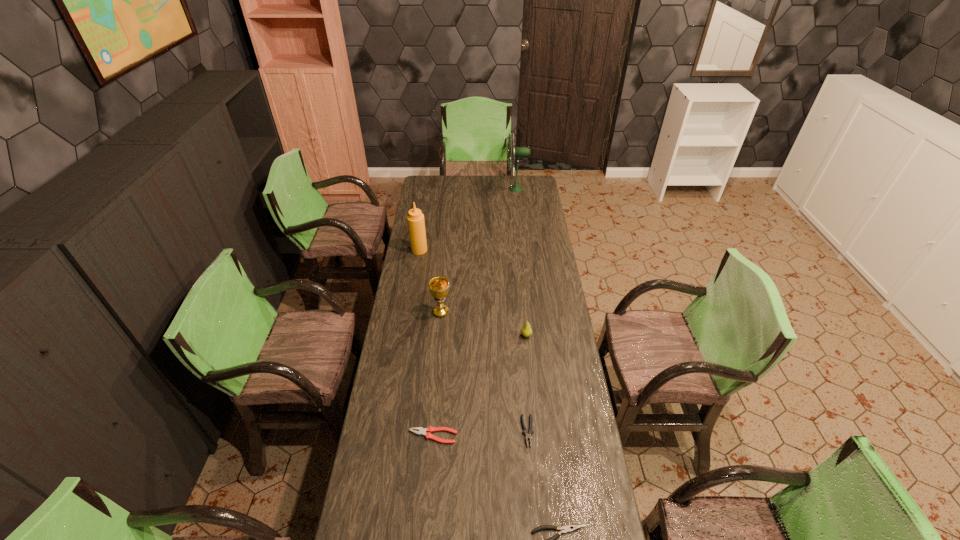
What are the coordinates of `object located at the far right corner` in the screenshot? It's located at (518, 152).

The width and height of the screenshot is (960, 540). I want to click on free region at the far edge of the desktop, so click(484, 184).

The image size is (960, 540). In the image, there is a desktop. What are the coordinates of `free space at the left edge` in the screenshot? It's located at (382, 451).

Find the location of a particular element. This screenshot has height=540, width=960. vacant space at the right edge of the desktop is located at coordinates click(x=600, y=528).

This screenshot has width=960, height=540. What are the coordinates of `free space at the far right corner` in the screenshot? It's located at (526, 190).

Locate an element on the screen. The image size is (960, 540). vacant space in between the farthest object and the leftmost object is located at coordinates (468, 219).

Locate an element on the screen. empty space that is in between the leftmost pliers and the fan is located at coordinates (475, 312).

Locate an element on the screen. vacant space in between the leftmost object and the leftmost pliers is located at coordinates (426, 343).

This screenshot has width=960, height=540. Identify the location of vacant area between the leftmost pliers and the fourth nearest object. (480, 386).

Choose which object is the sixth nearest neighbor to the third tallest object. Please provide its 2D coordinates. Your answer should be formatted as a tuple, i.e. [(x, y)], where the tuple contains the x and y coordinates of a point satisfying the conditions above.

[(518, 152)]